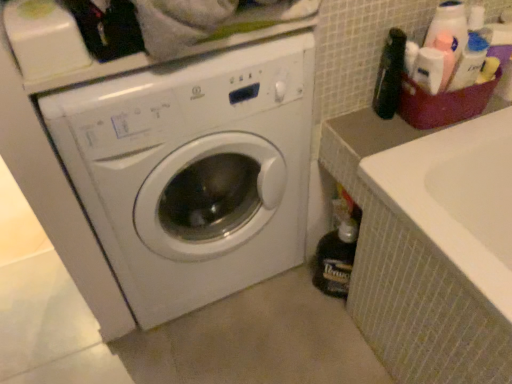
Question: From a real-world perspective, is dark brown glass bottle at lower right, which is the 1th bottle from back to front, positioned over white glossy washing machine at center based on gravity?

Choices:
 (A) yes
 (B) no

Answer: (B)

Question: Would you say dark brown glass bottle at lower right, which appears as the 2th bottle when viewed from the top, contains white glossy washing machine at center?

Choices:
 (A) no
 (B) yes

Answer: (A)

Question: Can you confirm if dark brown glass bottle at lower right, the second bottle in the front-to-back sequence, is bigger than white glossy washing machine at center?

Choices:
 (A) yes
 (B) no

Answer: (B)

Question: From the image's perspective, would you say dark brown glass bottle at lower right, which is the 1th bottle from back to front, is shown under white glossy washing machine at center?

Choices:
 (A) no
 (B) yes

Answer: (B)

Question: Does dark brown glass bottle at lower right, the second bottle in the front-to-back sequence, turn towards white glossy washing machine at center?

Choices:
 (A) yes
 (B) no

Answer: (B)

Question: From the image's perspective, is plastic basket at upper right located above or below dark brown glass bottle at lower right, which is the 1th bottle from back to front?

Choices:
 (A) above
 (B) below

Answer: (A)

Question: Based on their positions, is plastic basket at upper right located to the left or right of dark brown glass bottle at lower right, which appears as the 2th bottle when viewed from the top?

Choices:
 (A) left
 (B) right

Answer: (B)

Question: Considering the positions of plastic basket at upper right and dark brown glass bottle at lower right, which is the 1th bottle from back to front, in the image, is plastic basket at upper right bigger or smaller than dark brown glass bottle at lower right, which is the 1th bottle from back to front,?

Choices:
 (A) big
 (B) small

Answer: (B)

Question: Relative to dark brown glass bottle at lower right, which appears as the 2th bottle when viewed from the top, is plastic basket at upper right in front or behind?

Choices:
 (A) front
 (B) behind

Answer: (A)

Question: Considering the positions of plastic basket at upper right and black plastic bottle at upper right, the 2th bottle ordered from the bottom, in the image, is plastic basket at upper right taller or shorter than black plastic bottle at upper right, the 2th bottle ordered from the bottom,?

Choices:
 (A) short
 (B) tall

Answer: (A)

Question: In the image, is plastic basket at upper right on the left side or the right side of black plastic bottle at upper right, which is the 2th bottle in back-to-front order?

Choices:
 (A) right
 (B) left

Answer: (A)

Question: Considering their positions, is plastic basket at upper right located in front of or behind black plastic bottle at upper right, the 2th bottle ordered from the bottom?

Choices:
 (A) front
 (B) behind

Answer: (B)

Question: From the image's perspective, is plastic basket at upper right positioned above or below black plastic bottle at upper right, which appears as the first bottle when viewed from the front?

Choices:
 (A) above
 (B) below

Answer: (B)

Question: In the image, is white glossy washing machine at center on the left side or the right side of plastic basket at upper right?

Choices:
 (A) right
 (B) left

Answer: (B)

Question: From the image's perspective, is white glossy washing machine at center located above or below plastic basket at upper right?

Choices:
 (A) above
 (B) below

Answer: (B)